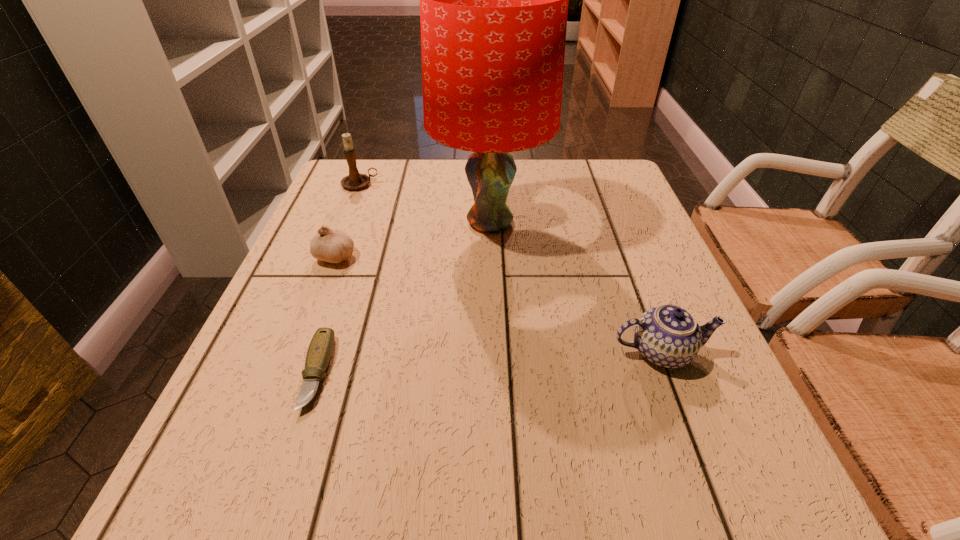
Locate an element on the screen. Image resolution: width=960 pixels, height=540 pixels. vacant space that satisfies the following two spatial constraints: 1. on the side of the candle holder with the handle; 2. on the back side of the shortest object is located at coordinates (286, 373).

The width and height of the screenshot is (960, 540). I want to click on vacant space that satisfies the following two spatial constraints: 1. on the side of the pocketknife with the handle; 2. on the left side of the fourth shortest object, so click(286, 373).

Image resolution: width=960 pixels, height=540 pixels. I want to click on free spot that satisfies the following two spatial constraints: 1. on the back side of the pocketknife; 2. on the side of the candle holder with the handle, so click(379, 185).

You are a GUI agent. You are given a task and a screenshot of the screen. Output one action in this format:
    pyautogui.click(x=<x>, y=<y>)
    Task: Click on the free space that satisfies the following two spatial constraints: 1. on the side of the fourth shortest object with the handle; 2. on the left side of the second shortest object
    The height and width of the screenshot is (540, 960).
    Given the screenshot: What is the action you would take?
    pyautogui.click(x=332, y=256)